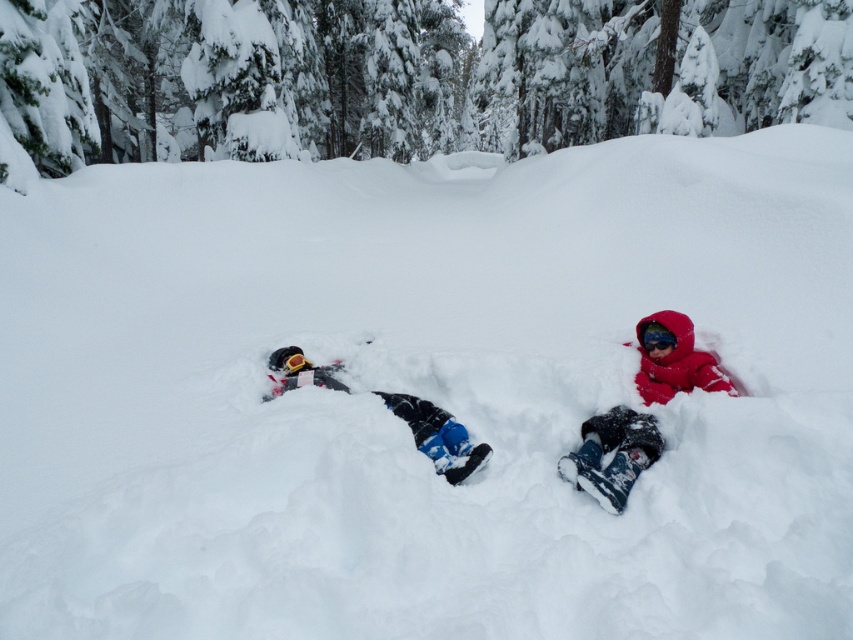
Does red fleece snowsuit at center appear over matte black snow angel at center?

Yes.

Is red fleece snowsuit at center to the left of matte black snow angel at center from the viewer's perspective?

In fact, red fleece snowsuit at center is to the right of matte black snow angel at center.

Who is more forward, (587, 426) or (264, 397)?

Positioned in front is point (587, 426).

Where is `red fleece snowsuit at center`? This screenshot has width=853, height=640. red fleece snowsuit at center is located at coordinates pos(614,454).